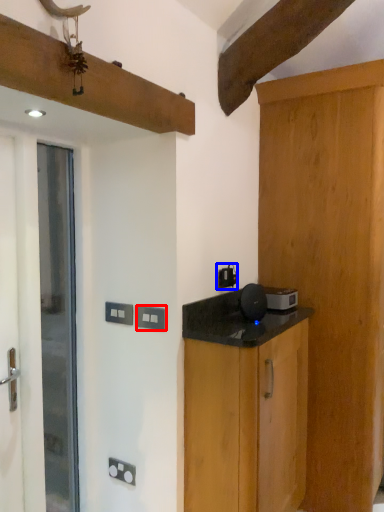
Question: Which object is closer to the camera taking this photo, electric outlet (highlighted by a red box) or electric outlet (highlighted by a blue box)?

Choices:
 (A) electric outlet
 (B) electric outlet

Answer: (A)